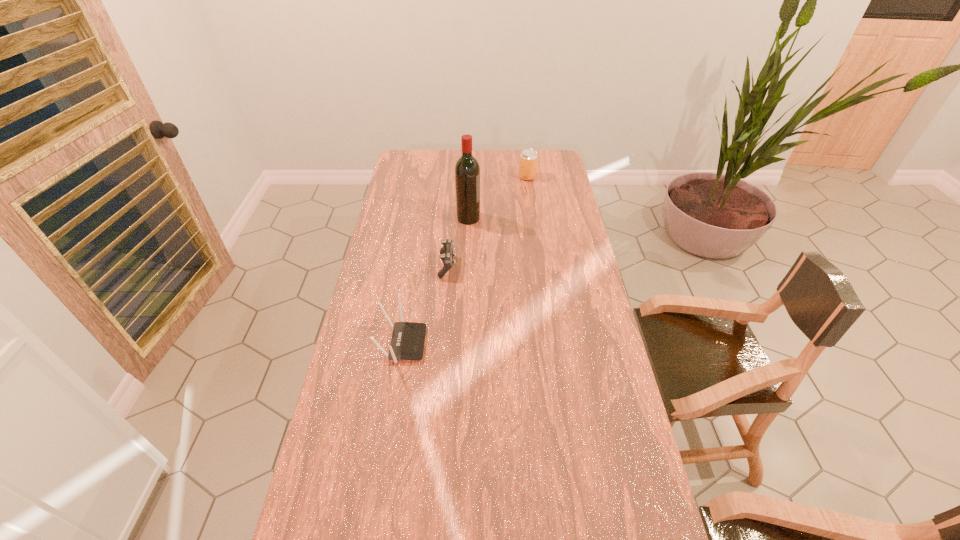
In order to click on vacant space located 0.080m on the front-facing side of the router in this screenshot , I will do `click(450, 343)`.

Locate an element on the screen. vacant area located 0.300m on the surface of the shortest object with buttons is located at coordinates (537, 266).

At what (x,y) coordinates should I click in order to perform the action: click on object that is at the far edge. Please return your answer as a coordinate pair (x, y). This screenshot has width=960, height=540. Looking at the image, I should click on (528, 158).

Locate an element on the screen. This screenshot has width=960, height=540. object at the left edge is located at coordinates (408, 338).

Image resolution: width=960 pixels, height=540 pixels. I want to click on object present at the right edge, so click(528, 158).

You are a GUI agent. You are given a task and a screenshot of the screen. Output one action in this format:
    pyautogui.click(x=<x>, y=<y>)
    Task: Click on the object at the far right corner
    This screenshot has width=960, height=540.
    Given the screenshot: What is the action you would take?
    pyautogui.click(x=528, y=158)

In the image, there is a desktop. At what (x,y) coordinates should I click in order to perform the action: click on vacant space at the far edge. Please return your answer as a coordinate pair (x, y). Looking at the image, I should click on (507, 167).

The width and height of the screenshot is (960, 540). Identify the location of blank space at the left edge of the desktop. (349, 454).

Find the location of `free space at the right edge of the desktop`. free space at the right edge of the desktop is located at coordinates (580, 254).

I want to click on free region at the far right corner of the desktop, so click(x=549, y=163).